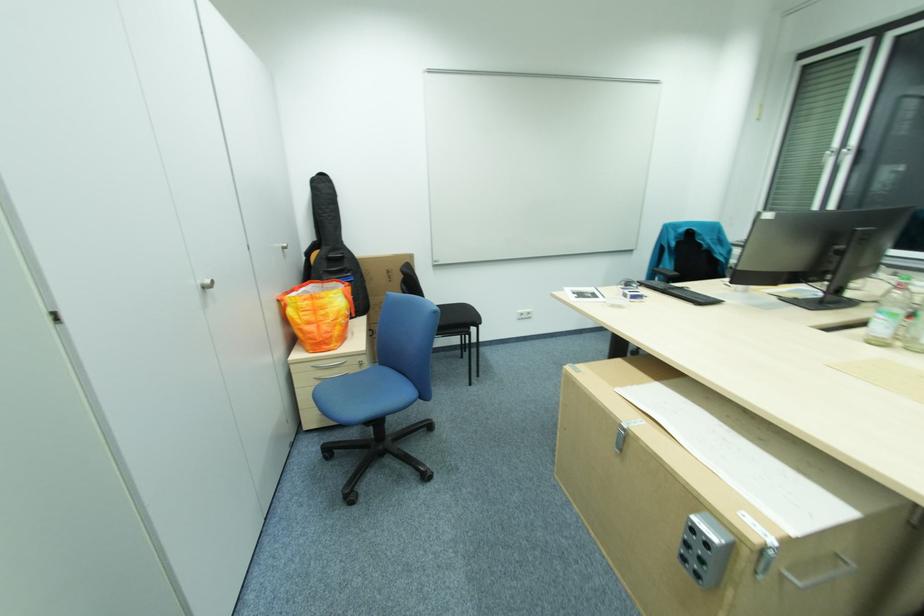
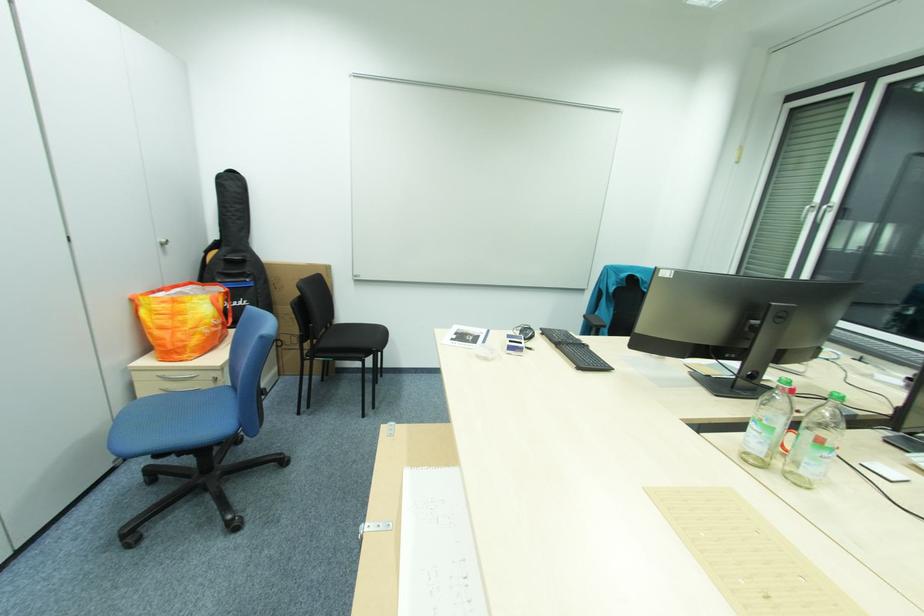
Question: The first image is from the beginning of the video and the second image is from the end. How did the camera likely rotate when shooting the video?

Choices:
 (A) Left
 (B) Right
 (C) Up
 (D) Down

Answer: (A)